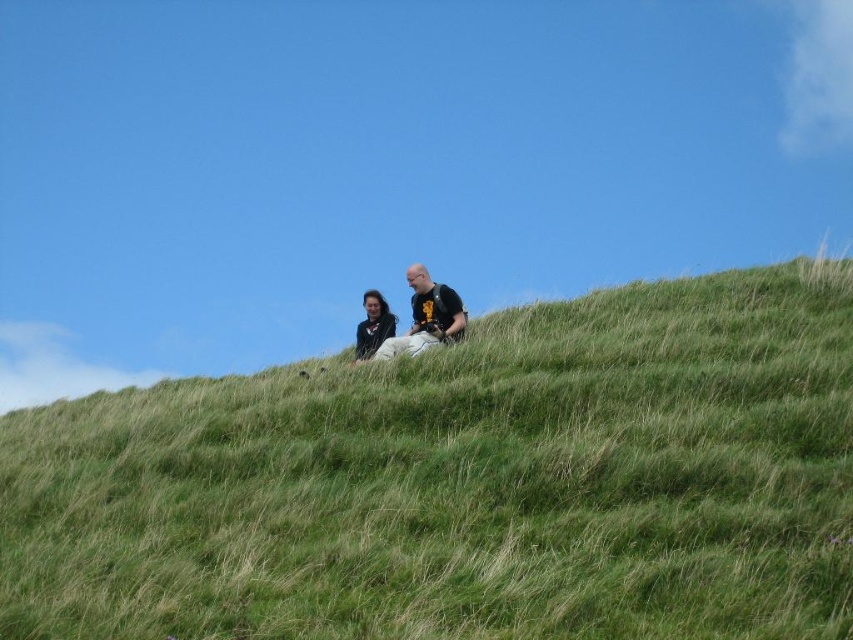
Which is in front, point (445, 291) or point (364, 333)?

Point (445, 291) is more forward.

This screenshot has height=640, width=853. I want to click on black matte shirt at center, so click(426, 316).

Is green grassy hillside at upper center to the left of smooth black jacket at center from the viewer's perspective?

In fact, green grassy hillside at upper center is to the right of smooth black jacket at center.

Does green grassy hillside at upper center have a greater height compared to smooth black jacket at center?

Yes, green grassy hillside at upper center is taller than smooth black jacket at center.

Is point (643, 307) positioned behind point (383, 333)?

That is False.

Where is `green grassy hillside at upper center`? green grassy hillside at upper center is located at coordinates pyautogui.click(x=463, y=483).

Is the position of green grassy hillside at upper center less distant than that of black matte shirt at center?

Yes, green grassy hillside at upper center is in front of black matte shirt at center.

Is green grassy hillside at upper center wider than black matte shirt at center?

Yes.

Who is more distant from viewer, (849, 355) or (401, 339)?

The point (401, 339) is behind.

Where is `green grassy hillside at upper center`? The height and width of the screenshot is (640, 853). green grassy hillside at upper center is located at coordinates (463, 483).